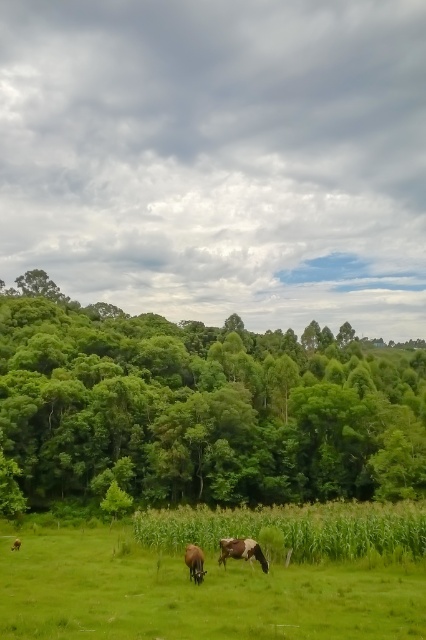
Between point (319, 564) and point (244, 556), which one is positioned in front?

Point (244, 556) is more forward.

Does green grass pasture at lower center have a smaller size compared to brown and white cow at center?

No.

Where is `green grass pasture at lower center`? green grass pasture at lower center is located at coordinates (192, 593).

At what (x,y) coordinates should I click in order to perform the action: click on green grass pasture at lower center. Please return your answer as a coordinate pair (x, y). Looking at the image, I should click on (192, 593).

Measure the distance from brown and white cow at center to brown glossy horse at center.

brown and white cow at center and brown glossy horse at center are 2.20 meters apart from each other.

Is brown and white cow at center positioned before brown glossy horse at center?

No, it is not.

Is point (250, 547) farther from camera compared to point (204, 573)?

Yes, point (250, 547) is behind point (204, 573).

This screenshot has width=426, height=640. I want to click on brown and white cow at center, so click(241, 552).

Which of these two, green leafy trees at left or brown glossy cow at center, stands taller?

Standing taller between the two is green leafy trees at left.

Can you confirm if green leafy trees at left is positioned below brown glossy cow at center?

No, green leafy trees at left is not below brown glossy cow at center.

I want to click on green leafy trees at left, so tap(199, 406).